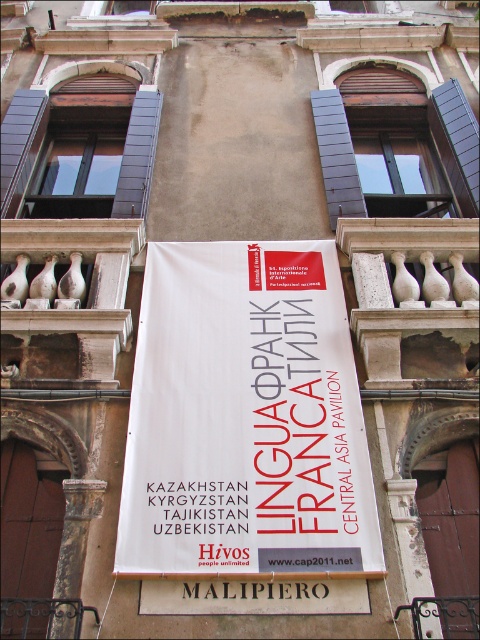
Does white marble balustrade at upper left come behind dark gray wood shutter at upper left?

That is False.

Does white marble balustrade at upper left have a larger size compared to dark gray wood shutter at upper left?

Yes.

What are the coordinates of `white marble balustrade at upper left` in the screenshot? It's located at (69, 294).

Can you confirm if blue painted wood shutter at upper right is smaller than dark gray wood shutter at upper center?

Yes.

Which is in front, point (456, 141) or point (346, 198)?

Point (346, 198) is more forward.

Image resolution: width=480 pixels, height=640 pixels. What are the coordinates of `blue painted wood shutter at upper right` in the screenshot? It's located at (456, 141).

Who is positioned more to the left, white paper banner at center or white marble balustrade at upper left?

Positioned to the left is white marble balustrade at upper left.

Based on the photo, which is above, white paper banner at center or white marble balustrade at upper left?

white marble balustrade at upper left

Image resolution: width=480 pixels, height=640 pixels. What do you see at coordinates (245, 417) in the screenshot?
I see `white paper banner at center` at bounding box center [245, 417].

The height and width of the screenshot is (640, 480). What are the coordinates of `white paper banner at center` in the screenshot? It's located at (245, 417).